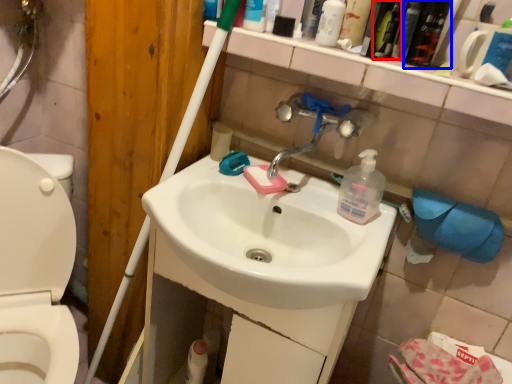
Question: Which point is further to the camera, mouthwash (highlighted by a red box) or mouthwash (highlighted by a blue box)?

Choices:
 (A) mouthwash
 (B) mouthwash

Answer: (A)